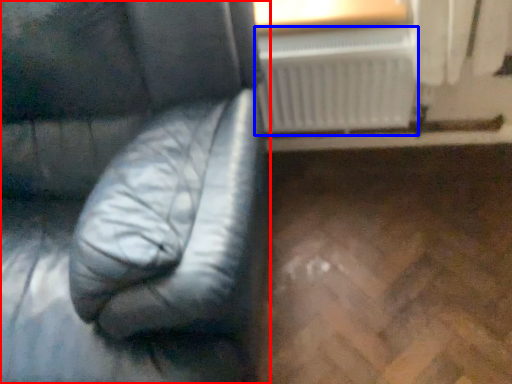
Question: Which object is further to the camera taking this photo, furniture (highlighted by a red box) or radiator (highlighted by a blue box)?

Choices:
 (A) furniture
 (B) radiator

Answer: (B)